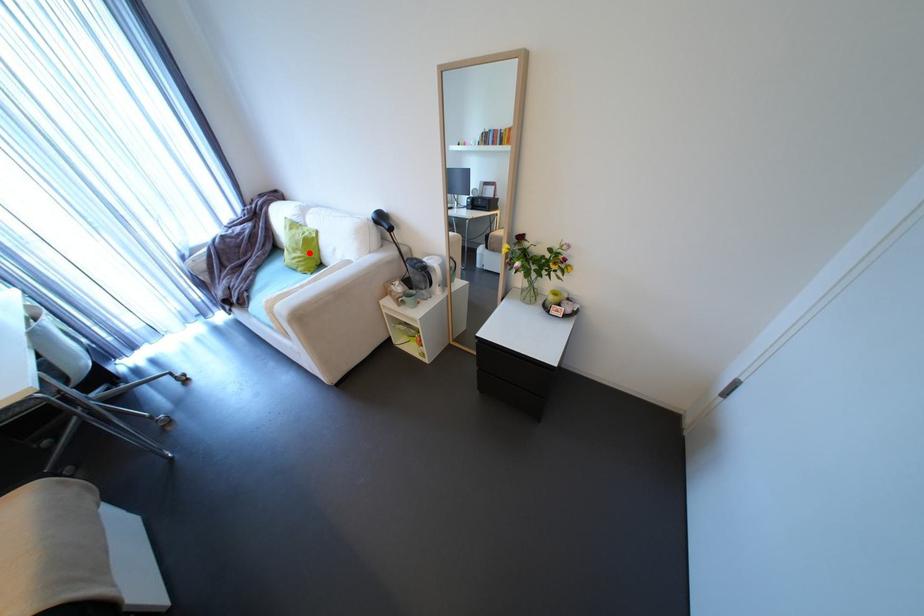
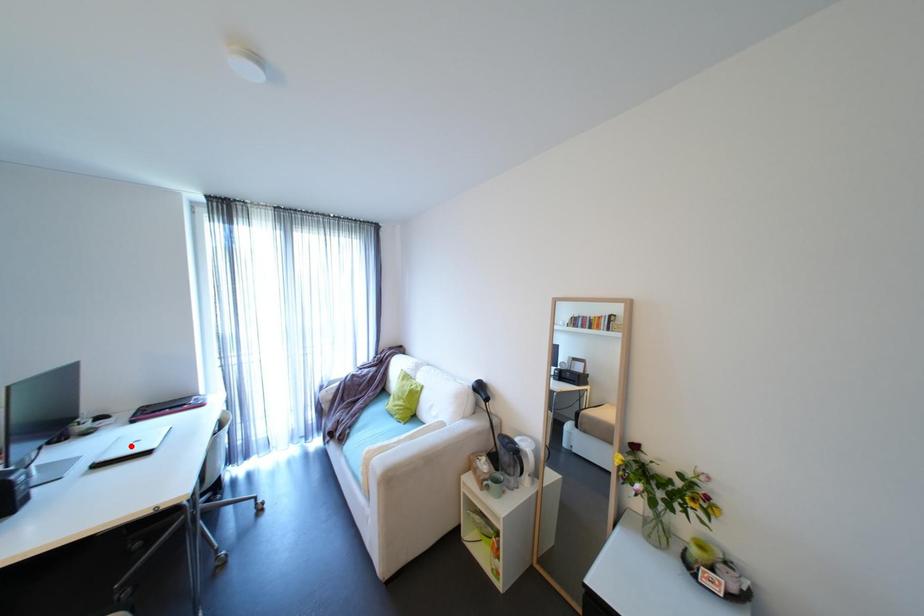
I am providing you with two images of the same scene from different viewpoints. A red point is marked on the first image and another point is marked on the second image. Do the highlighted points in image1 and image2 indicate the same real-world spot?

No